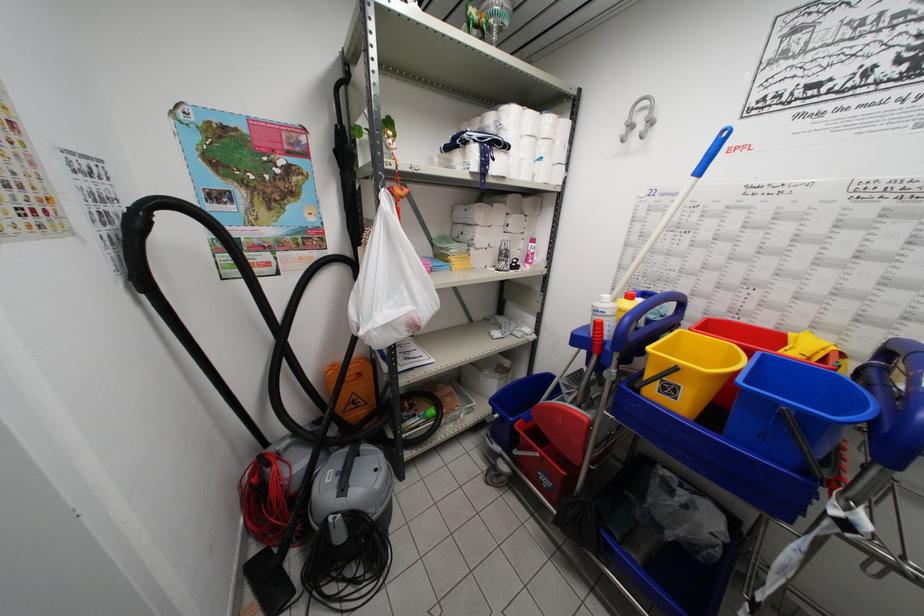
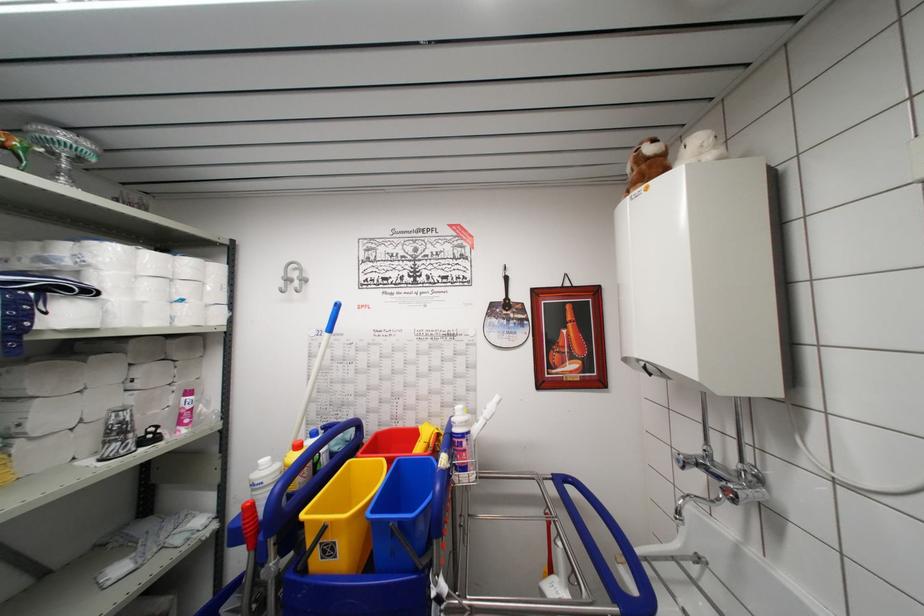
Find the pixel in the second image that matches (x=610, y=318) in the first image.

(269, 488)